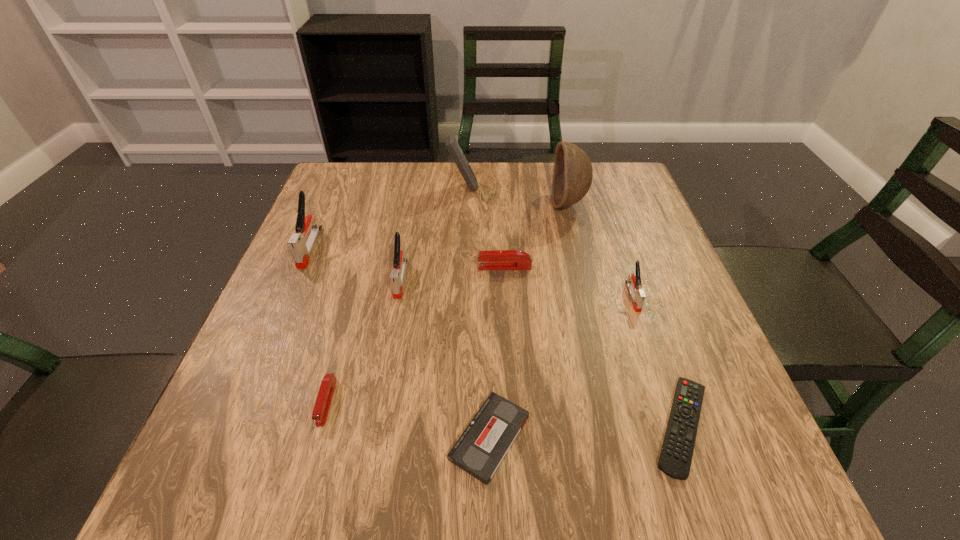
Locate an element on the screen. The width and height of the screenshot is (960, 540). bowl that is at the right edge is located at coordinates (572, 176).

The height and width of the screenshot is (540, 960). What are the coordinates of `stapler that is at the right edge` in the screenshot? It's located at (634, 285).

Locate an element on the screen. The image size is (960, 540). remote control present at the right edge is located at coordinates (675, 459).

Image resolution: width=960 pixels, height=540 pixels. I want to click on object situated at the far right corner, so click(x=572, y=176).

This screenshot has width=960, height=540. I want to click on object at the near right corner, so click(675, 459).

Locate an element on the screen. Image resolution: width=960 pixels, height=540 pixels. vacant space at the far edge is located at coordinates (519, 184).

In the image, there is a desktop. At what (x,y) coordinates should I click in order to perform the action: click on vacant space at the left edge. Please return your answer as a coordinate pair (x, y). Looking at the image, I should click on (302, 424).

In the image, there is a desktop. Where is `vacant space at the right edge`? vacant space at the right edge is located at coordinates (659, 242).

What are the coordinates of `vacant position at the far left corner of the desktop` in the screenshot? It's located at (324, 187).

Locate an element on the screen. This screenshot has width=960, height=540. free spot between the bowl and the third shortest stapler is located at coordinates (601, 250).